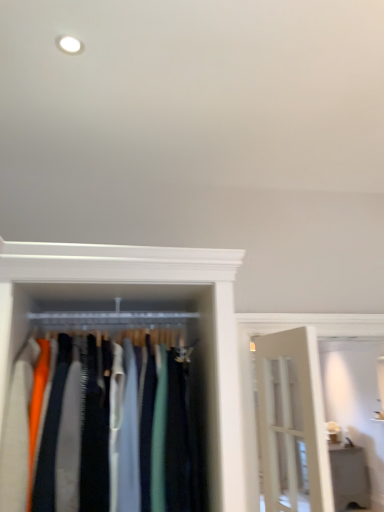
Where is `matte fabric clothes at center`? Image resolution: width=384 pixels, height=512 pixels. matte fabric clothes at center is located at coordinates (145, 283).

What do you see at coordinates (145, 283) in the screenshot?
I see `matte fabric clothes at center` at bounding box center [145, 283].

I want to click on white glossy shelf at lower right, so click(349, 476).

This screenshot has width=384, height=512. Describe the element at coordinates (349, 476) in the screenshot. I see `white glossy shelf at lower right` at that location.

Image resolution: width=384 pixels, height=512 pixels. Identify the location of matte fabric clothes at center. (145, 283).

Considering the relative positions of white glossy shelf at lower right and matte fabric clothes at center in the image provided, is white glossy shelf at lower right to the left of matte fabric clothes at center from the viewer's perspective?

In fact, white glossy shelf at lower right is to the right of matte fabric clothes at center.

Which object is closer to the camera, white glossy shelf at lower right or matte fabric clothes at center?

matte fabric clothes at center is closer to the camera.

Is point (334, 495) behind point (91, 253)?

Yes, it is behind point (91, 253).

From the image's perspective, which object appears higher, white glossy shelf at lower right or matte fabric clothes at center?

matte fabric clothes at center is shown above in the image.

From a real-world perspective, is white glossy shelf at lower right physically below matte fabric clothes at center?

Yes, from a real-world perspective, white glossy shelf at lower right is beneath matte fabric clothes at center.

Can you confirm if white glossy shelf at lower right is thinner than matte fabric clothes at center?

Yes, white glossy shelf at lower right is thinner than matte fabric clothes at center.

Considering the relative sizes of white glossy shelf at lower right and matte fabric clothes at center in the image provided, is white glossy shelf at lower right shorter than matte fabric clothes at center?

Yes, white glossy shelf at lower right is shorter than matte fabric clothes at center.

In the scene shown: Is white glossy shelf at lower right bigger than matte fabric clothes at center?

Yes, white glossy shelf at lower right is bigger than matte fabric clothes at center.

Would you say white glossy shelf at lower right contains matte fabric clothes at center?

No, matte fabric clothes at center is located outside of white glossy shelf at lower right.

Are white glossy shelf at lower right and matte fabric clothes at center beside each other?

No, white glossy shelf at lower right is not next to matte fabric clothes at center.

Is white glossy shelf at lower right turned away from matte fabric clothes at center?

white glossy shelf at lower right does not have its back to matte fabric clothes at center.

The height and width of the screenshot is (512, 384). Find the location of `closet located on the left of white glossy shelf at lower right`. closet located on the left of white glossy shelf at lower right is located at coordinates coord(145,283).

Considering the positions of objects matte fabric clothes at center and white glossy shelf at lower right in the image provided, who is more to the left, matte fabric clothes at center or white glossy shelf at lower right?

From the viewer's perspective, matte fabric clothes at center appears more on the left side.

Is matte fabric clothes at center in front of or behind white glossy shelf at lower right in the image?

Clearly, matte fabric clothes at center is in front of white glossy shelf at lower right.

Is point (222, 255) positioned behind point (339, 467)?

No, (222, 255) is closer to viewer.

From the image's perspective, would you say matte fabric clothes at center is positioned over white glossy shelf at lower right?

Yes, from the image's perspective, matte fabric clothes at center is over white glossy shelf at lower right.

From a real-world perspective, is matte fabric clothes at center above or below white glossy shelf at lower right?

matte fabric clothes at center is situated higher than white glossy shelf at lower right in the real world.

Considering the relative sizes of matte fabric clothes at center and white glossy shelf at lower right in the image provided, is matte fabric clothes at center thinner than white glossy shelf at lower right?

In fact, matte fabric clothes at center might be wider than white glossy shelf at lower right.

Can you confirm if matte fabric clothes at center is shorter than white glossy shelf at lower right?

No, matte fabric clothes at center is not shorter than white glossy shelf at lower right.

Can you confirm if matte fabric clothes at center is smaller than white glossy shelf at lower right?

Yes.

Is matte fabric clothes at center inside the boundaries of white glossy shelf at lower right, or outside?

matte fabric clothes at center is outside white glossy shelf at lower right.

Are matte fabric clothes at center and white glossy shelf at lower right located far from each other?

matte fabric clothes at center is positioned a significant distance from white glossy shelf at lower right.

Does matte fabric clothes at center turn towards white glossy shelf at lower right?

No.

Find the location of a particular element. furniture on the right of matte fabric clothes at center is located at coordinates click(x=349, y=476).

This screenshot has width=384, height=512. I want to click on furniture located on the right of matte fabric clothes at center, so click(349, 476).

I want to click on furniture below the matte fabric clothes at center (from the image's perspective), so click(x=349, y=476).